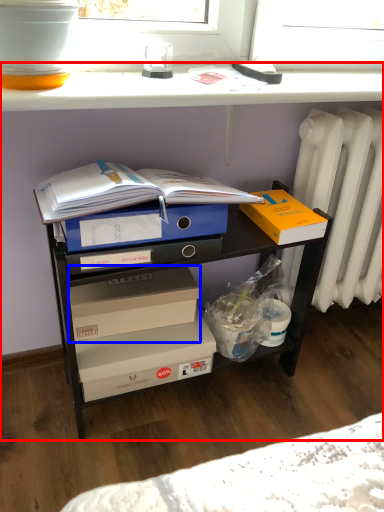
Question: Which of the following is the closest to the observer, desk (highlighted by a red box) or box (highlighted by a blue box)?

Choices:
 (A) desk
 (B) box

Answer: (A)